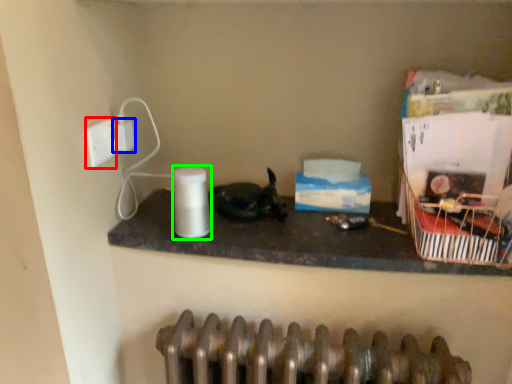
Question: Based on their relative distances, which object is farther from socket (highlighted by a red box)? Choose from electric outlet (highlighted by a blue box) and paper towel (highlighted by a green box).

Choices:
 (A) electric outlet
 (B) paper towel

Answer: (B)